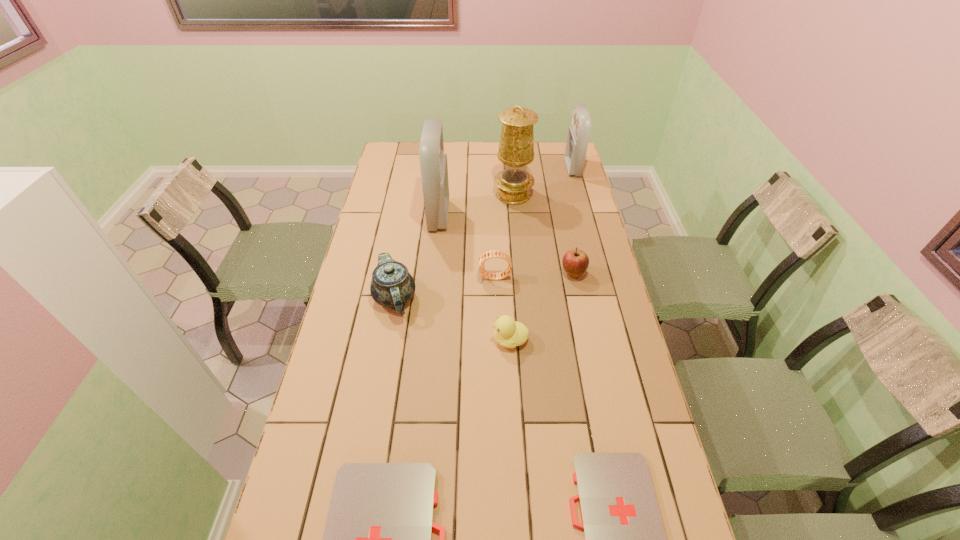
The image size is (960, 540). In order to click on blank area at the right edge in this screenshot , I will do `click(574, 309)`.

In the image, there is a desktop. Where is `blank space at the far left corner`? The image size is (960, 540). blank space at the far left corner is located at coordinates pos(389,161).

The width and height of the screenshot is (960, 540). I want to click on vacant space that is in between the black watch and the oil lamp, so click(504, 236).

Find the location of a particular element. This screenshot has height=540, width=960. empty space that is in between the third nearest object and the third tallest object is located at coordinates (541, 254).

Locate an element on the screen. This screenshot has width=960, height=540. vacant area that lies between the tallest first-aid kit and the oil lamp is located at coordinates (476, 205).

Where is `unoccupied area between the red apple and the farthest object`? The width and height of the screenshot is (960, 540). unoccupied area between the red apple and the farthest object is located at coordinates (573, 221).

Image resolution: width=960 pixels, height=540 pixels. Find the location of `empty space that is in between the red apple and the watch`. empty space that is in between the red apple and the watch is located at coordinates (535, 275).

Locate an element on the screen. This screenshot has width=960, height=540. empty space that is in between the chinaware and the smaller red first-aid kit is located at coordinates (484, 233).

I want to click on vacant space that's between the yellow duckling and the chinaware, so click(452, 319).

At what (x,y) coordinates should I click in order to perform the action: click on object that stands as the eighth closest to the oil lamp. Please return your answer as a coordinate pair (x, y). This screenshot has width=960, height=540. Looking at the image, I should click on (377, 539).